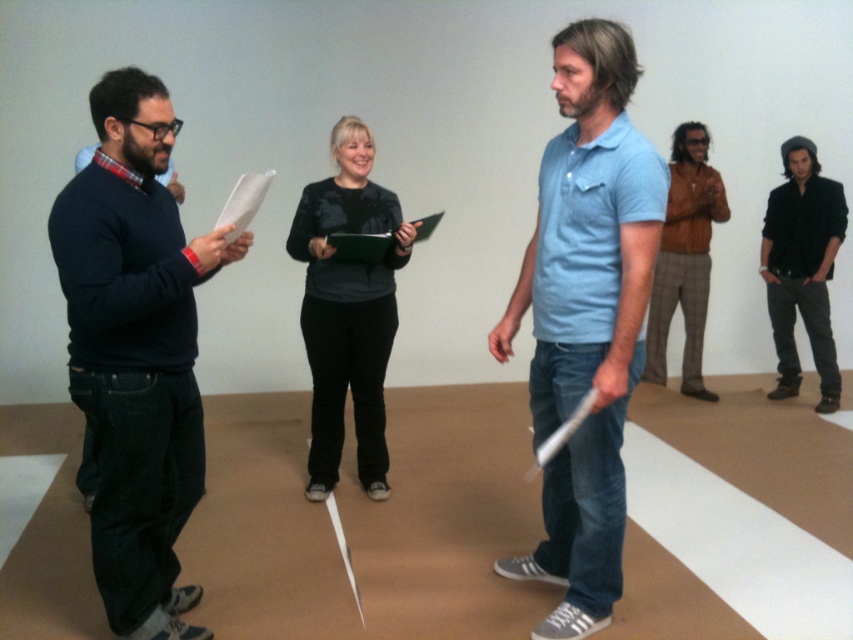
You are a photographer who needs to adjust the distance between the light blue cotton polo shirt at center and the camera to ensure optimal focus. The current distance is 6.53 feet. According to photography guidelines, the ideal distance for clear portraits is between 5 to 7 feet. Is the current distance within the recommended range?

The current distance between the light blue cotton polo shirt at center and the camera is 6.53 feet, which falls within the recommended 5 to 7 feet range for optimal focus in portraits.

You are an interior designer observing the image. You need to determine which object is taller between the matte black sweater at left and the black matte shirt at upper right without measuring tools. Based on their positions, which one do you think is taller?

The matte black sweater at left is taller than the black matte shirt at upper right.

You are a photographer positioned at the back of the room. You want to take a photo that clearly captures both the light blue cotton polo shirt at center and the black matte shirt at upper right. Which shirt will appear larger in the photo?

The light blue cotton polo shirt at center will appear larger in the photo because it is closer to the viewer than the black matte shirt at upper right.